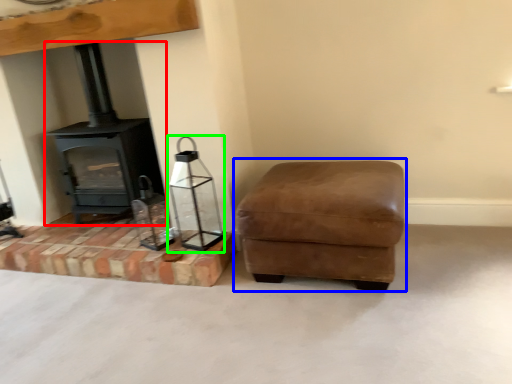
Question: Estimate the real-world distances between objects in this image. Which object is farther from wood burning stove (highlighted by a red box), rocking chair (highlighted by a blue box) or candle holder (highlighted by a green box)?

Choices:
 (A) rocking chair
 (B) candle holder

Answer: (A)